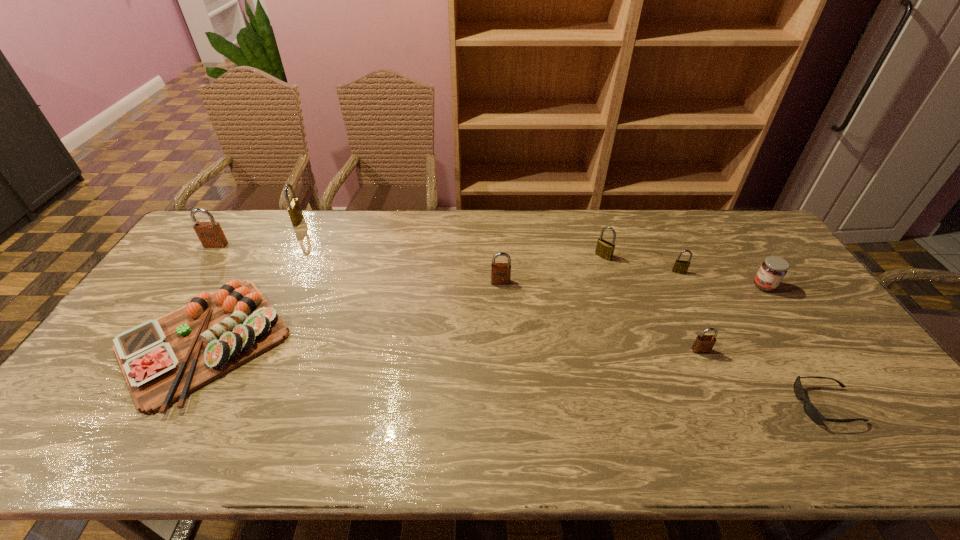
This screenshot has width=960, height=540. What are the coordinates of `free space located on the front of the third nearest padlock` in the screenshot? It's located at (711, 338).

Image resolution: width=960 pixels, height=540 pixels. Find the location of `vacant position located on the front-facing side of the nearest padlock`. vacant position located on the front-facing side of the nearest padlock is located at coordinates (750, 460).

What are the coordinates of `vacant space positioned on the front of the platter` in the screenshot? It's located at click(148, 437).

Locate an element on the screen. blank space located 0.260m on the front-facing side of the shortest object is located at coordinates (691, 405).

Where is `vacant space positioned 0.240m on the front-facing side of the shortest object`? Image resolution: width=960 pixels, height=540 pixels. vacant space positioned 0.240m on the front-facing side of the shortest object is located at coordinates (700, 405).

Locate an element on the screen. The height and width of the screenshot is (540, 960). free space located on the front-facing side of the shortest object is located at coordinates (675, 405).

Where is `object that is at the near edge`? object that is at the near edge is located at coordinates (811, 411).

Where is `padlock at the left edge`? The width and height of the screenshot is (960, 540). padlock at the left edge is located at coordinates (210, 234).

Locate an element on the screen. platter at the left edge is located at coordinates (163, 360).

This screenshot has height=540, width=960. I want to click on jam that is at the right edge, so tap(772, 271).